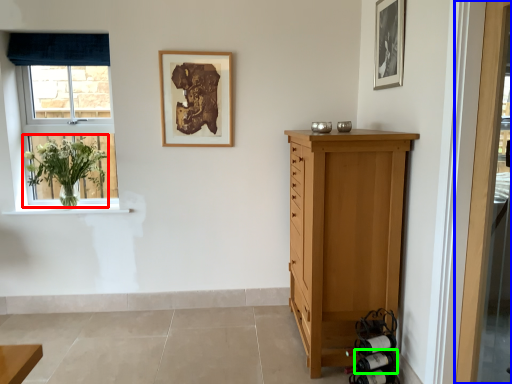
Question: Which object is the closest to the floral arrangement (highlighted by a red box)? Choose among these: door (highlighted by a blue box) or wine bottle (highlighted by a green box).

Choices:
 (A) door
 (B) wine bottle

Answer: (B)